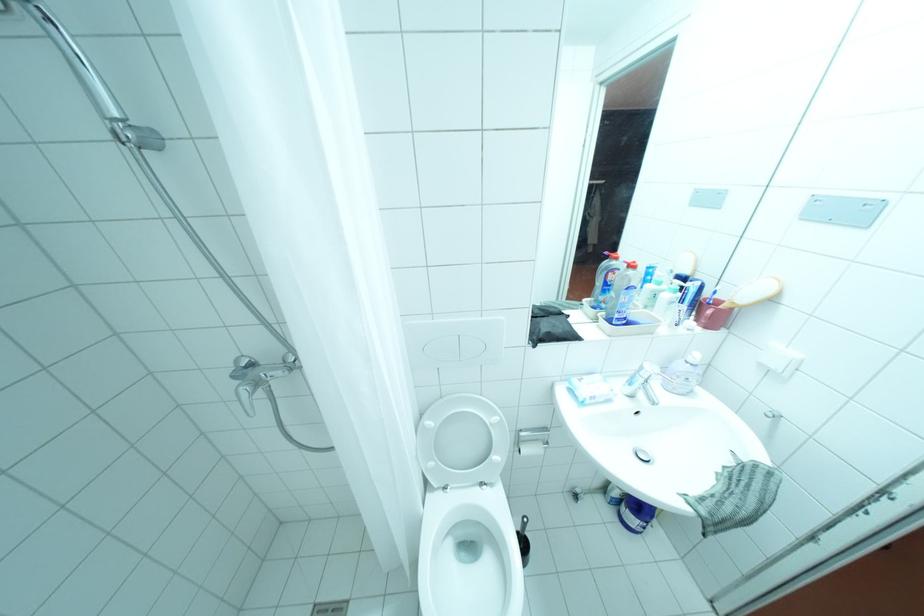
The image size is (924, 616). Identify the location of sink faucet handle. (641, 383).